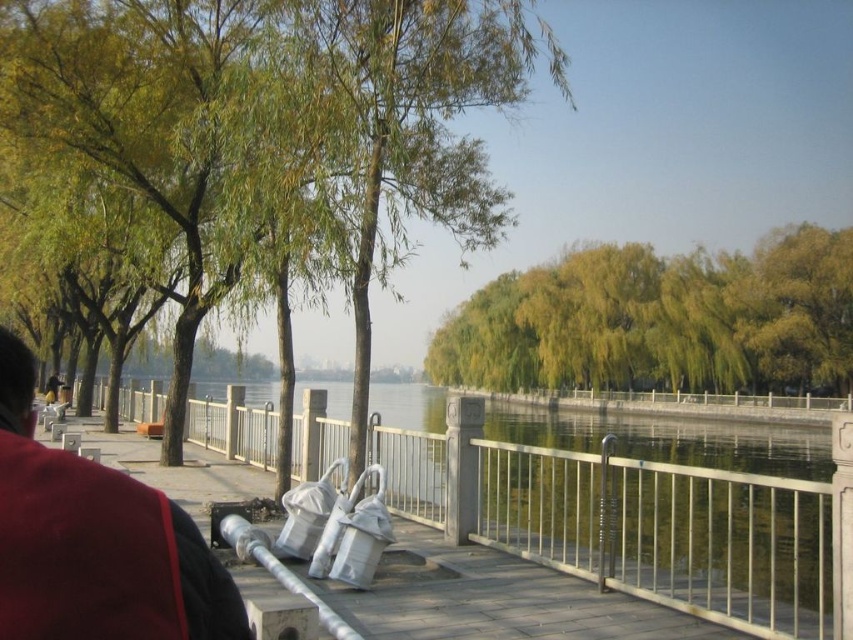
Question: Is green leafy tree at left smaller than green stone river at center?

Choices:
 (A) no
 (B) yes

Answer: (A)

Question: Which point appears farthest from the camera in this image?

Choices:
 (A) (408, 116)
 (B) (798, 355)

Answer: (B)

Question: Can you confirm if green leafy tree at left is positioned above green stone river at center?

Choices:
 (A) yes
 (B) no

Answer: (A)

Question: Which point appears farthest from the camera in this image?

Choices:
 (A) (244, 97)
 (B) (306, 416)

Answer: (B)

Question: Can you confirm if green leafy tree at left is wider than yellow-green leaves at center?

Choices:
 (A) no
 (B) yes

Answer: (A)

Question: Which object is the farthest from the green stone river at center?

Choices:
 (A) green leafy tree at left
 (B) yellow-green leaves at center

Answer: (B)